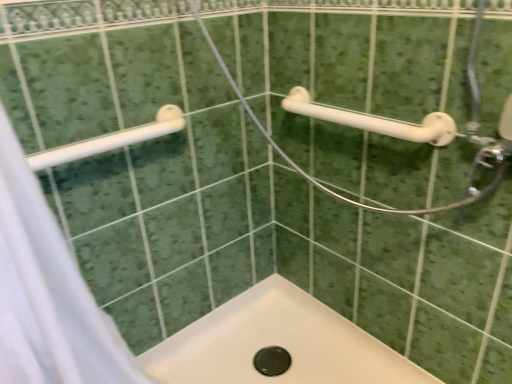
Question: From a real-world perspective, relative to white fabric shower curtain at left, is white plastic grab bar at upper right, acting as the first towel rack starting from the right, vertically above or below?

Choices:
 (A) above
 (B) below

Answer: (A)

Question: From the image's perspective, is white plastic grab bar at upper right, acting as the first towel rack starting from the right, positioned above or below white fabric shower curtain at left?

Choices:
 (A) below
 (B) above

Answer: (B)

Question: Which is farther from the white plastic towel rack at upper left, positioned as the 1th towel rack in left-to-right order?

Choices:
 (A) white fabric shower curtain at left
 (B) white plastic grab bar at upper right, acting as the first towel rack starting from the right

Answer: (B)

Question: Considering the real-world distances, which object is closest to the white plastic grab bar at upper right, acting as the first towel rack starting from the right?

Choices:
 (A) white plastic towel rack at upper left, the 2th towel rack viewed from the right
 (B) white fabric shower curtain at left

Answer: (A)